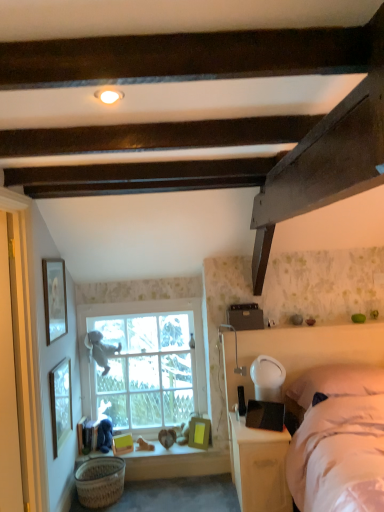
Locate an element on the screen. vacant area located to the right-hand side of woven brown basket at lower left is located at coordinates (144, 495).